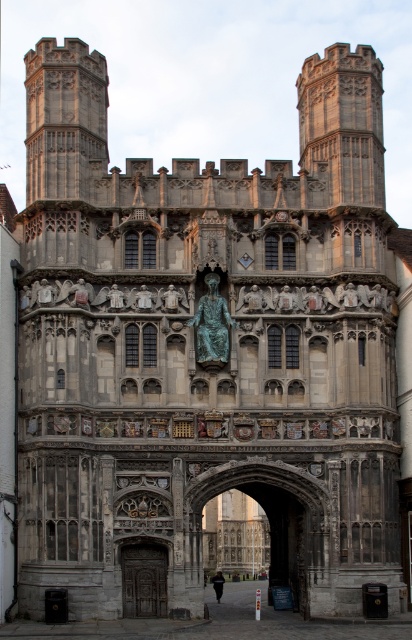
Which is above, stone textured tower at upper left or stone archway at center?

stone textured tower at upper left is higher up.

Is point (32, 188) positioned after point (243, 467)?

Yes, it is behind point (243, 467).

Who is more forward, (46, 163) or (247, 484)?

Positioned in front is point (247, 484).

Locate an element on the screen. stone textured tower at upper left is located at coordinates (65, 118).

What do you see at coordinates (65, 118) in the screenshot?
I see `stone textured tower at upper left` at bounding box center [65, 118].

Between point (46, 145) and point (135, 580), which one is positioned in front?

Point (135, 580) is more forward.

Who is more forward, (49, 81) or (147, 560)?

Point (147, 560) is more forward.

At what (x,y) coordinates should I click in order to perform the action: click on stone textured tower at upper left. Please return your answer as a coordinate pair (x, y). Looking at the image, I should click on (65, 118).

Does stone archway at center have a greater width compared to dark wood door at lower left?

Correct, the width of stone archway at center exceeds that of dark wood door at lower left.

Is point (325, 515) more distant than point (123, 550)?

Yes, point (325, 515) is behind point (123, 550).

Where is `stone archway at center`? The height and width of the screenshot is (640, 412). stone archway at center is located at coordinates (269, 520).